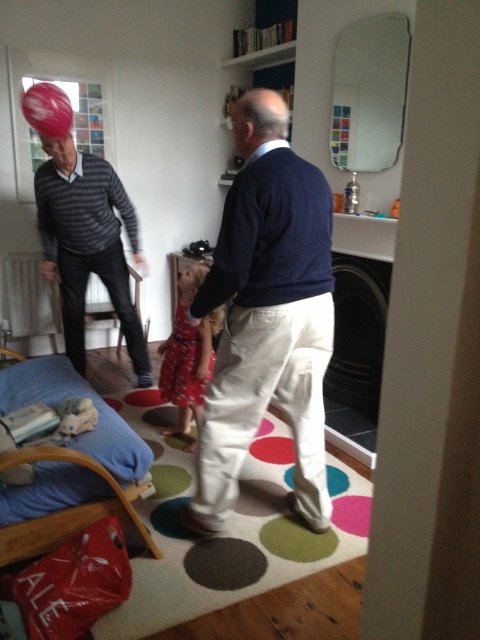
Which of these two, dark blue sweater at center or matte black sweater at left, stands taller?

dark blue sweater at center is taller.

Who is more distant from viewer, (296,406) or (55,202)?

The point (55,202) is more distant.

What are the coordinates of `dark blue sweater at center` in the screenshot? It's located at click(267, 314).

Is the position of matte black sweater at left less distant than that of matte red dress at center?

Yes, matte black sweater at left is closer to the viewer.

Which is behind, point (40, 237) or point (196, 273)?

The point (40, 237) is more distant.

Locate an element on the screen. This screenshot has height=640, width=480. matte black sweater at left is located at coordinates (86, 243).

You are a GUI agent. You are given a task and a screenshot of the screen. Output one action in this format:
    pyautogui.click(x=<x>, y=<y>)
    Task: Click on the matte black sweater at left
    The image size is (480, 640).
    Given the screenshot: What is the action you would take?
    pyautogui.click(x=86, y=243)

Can you confirm if smooth bald head at center is positioned above matte red dress at center?

Indeed, smooth bald head at center is positioned over matte red dress at center.

Can you confirm if smooth bald head at center is taller than matte red dress at center?

Correct, smooth bald head at center is much taller as matte red dress at center.

Where is `smooth bald head at center`? This screenshot has width=480, height=640. smooth bald head at center is located at coordinates (257, 120).